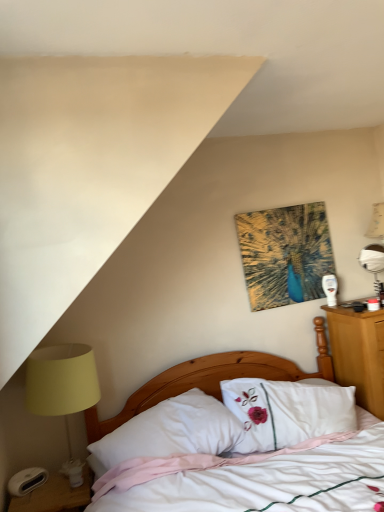
Question: From a real-world perspective, is matte yellow lampshade at left on top of white glossy nightstand at lower left?

Choices:
 (A) no
 (B) yes

Answer: (B)

Question: Could white glossy nightstand at lower left be considered to be inside matte yellow lampshade at left?

Choices:
 (A) no
 (B) yes

Answer: (A)

Question: Is matte yellow lampshade at left not inside white glossy nightstand at lower left?

Choices:
 (A) yes
 (B) no

Answer: (A)

Question: From the image's perspective, is matte yellow lampshade at left located above white glossy nightstand at lower left?

Choices:
 (A) no
 (B) yes

Answer: (B)

Question: From the image's perspective, is matte yellow lampshade at left below white glossy nightstand at lower left?

Choices:
 (A) no
 (B) yes

Answer: (A)

Question: Is matte yellow lampshade at left positioned in front of white glossy nightstand at lower left?

Choices:
 (A) yes
 (B) no

Answer: (B)

Question: Is metallic silver table lamp at right far away from matte yellow lampshade at left?

Choices:
 (A) no
 (B) yes

Answer: (B)

Question: From a real-world perspective, is metallic silver table lamp at right located beneath matte yellow lampshade at left?

Choices:
 (A) no
 (B) yes

Answer: (A)

Question: Is metallic silver table lamp at right completely or partially outside of matte yellow lampshade at left?

Choices:
 (A) yes
 (B) no

Answer: (A)

Question: From the image's perspective, does metallic silver table lamp at right appear lower than matte yellow lampshade at left?

Choices:
 (A) yes
 (B) no

Answer: (B)

Question: Is metallic silver table lamp at right to the right of matte yellow lampshade at left from the viewer's perspective?

Choices:
 (A) no
 (B) yes

Answer: (B)

Question: From the image's perspective, is metallic silver table lamp at right on matte yellow lampshade at left?

Choices:
 (A) no
 (B) yes

Answer: (B)

Question: Does matte yellow lampshade at left have a smaller size compared to abstract painting at upper center?

Choices:
 (A) yes
 (B) no

Answer: (B)